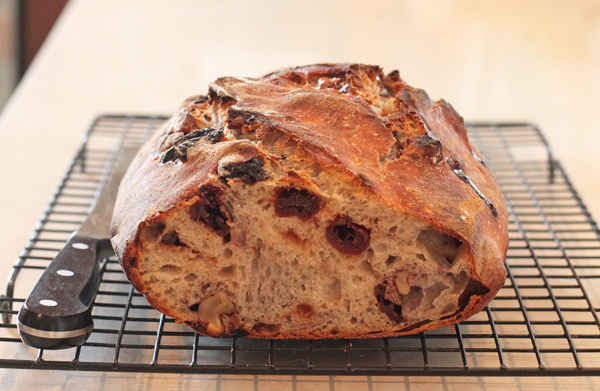
Image resolution: width=600 pixels, height=391 pixels. Find the location of `countertop`. countertop is located at coordinates (62, 106).